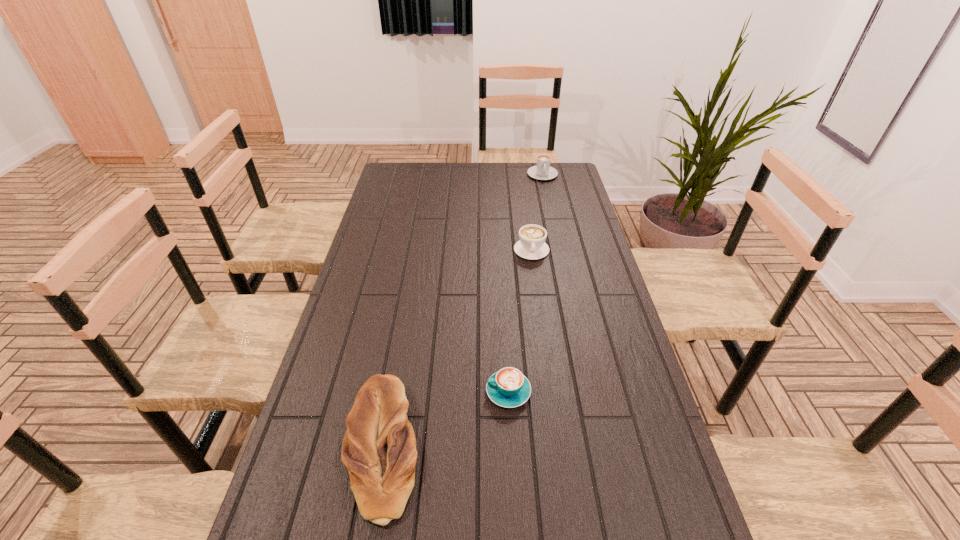
At what (x,y) coordinates should I click in order to perform the action: click on vacant area situated 0.350m with the handle on the right side of the shortest cappuccino. Please return your answer as a coordinate pair (x, y). The image size is (960, 540). Looking at the image, I should click on (351, 392).

This screenshot has width=960, height=540. Identify the location of object that is at the far edge. (543, 171).

At what (x,y) coordinates should I click in order to perform the action: click on object that is at the left edge. Please return your answer as a coordinate pair (x, y). The image size is (960, 540). Looking at the image, I should click on (379, 450).

Find the location of a particular element. The image size is (960, 540). object that is at the right edge is located at coordinates (543, 171).

Where is `object that is at the far right corner`? This screenshot has height=540, width=960. object that is at the far right corner is located at coordinates (543, 171).

At what (x,y) coordinates should I click in order to perform the action: click on vacant space at the far edge of the desktop. Please return your answer as a coordinate pair (x, y). The width and height of the screenshot is (960, 540). Looking at the image, I should click on (423, 165).

Identify the location of vacant space at the left edge of the desktop. Image resolution: width=960 pixels, height=540 pixels. (388, 207).

In the image, there is a desktop. At what (x,y) coordinates should I click in order to perform the action: click on free space at the right edge. Please return your answer as a coordinate pair (x, y). The width and height of the screenshot is (960, 540). Looking at the image, I should click on (564, 232).

Identify the location of vacant region at the far left corner of the desktop. This screenshot has height=540, width=960. (399, 176).

In the image, there is a desktop. At what (x,y) coordinates should I click in order to perform the action: click on vacant space at the far right corner. Please return your answer as a coordinate pair (x, y). The height and width of the screenshot is (540, 960). Looking at the image, I should click on (554, 188).